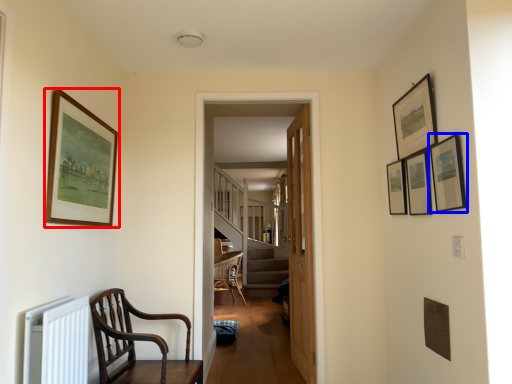
Question: Which object is closer to the camera taking this photo, picture frame (highlighted by a red box) or picture frame (highlighted by a blue box)?

Choices:
 (A) picture frame
 (B) picture frame

Answer: (B)